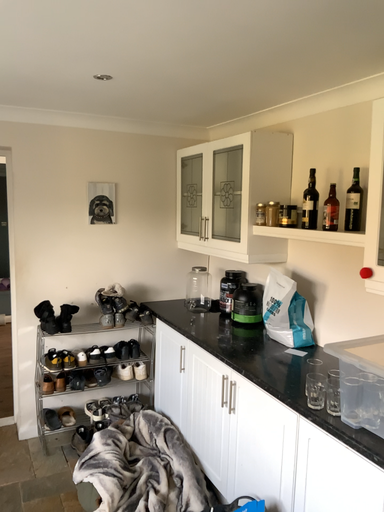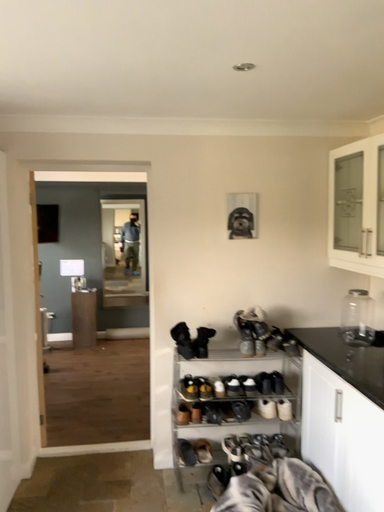
Question: How did the camera likely rotate when shooting the video?

Choices:
 (A) rotated right
 (B) rotated left

Answer: (B)